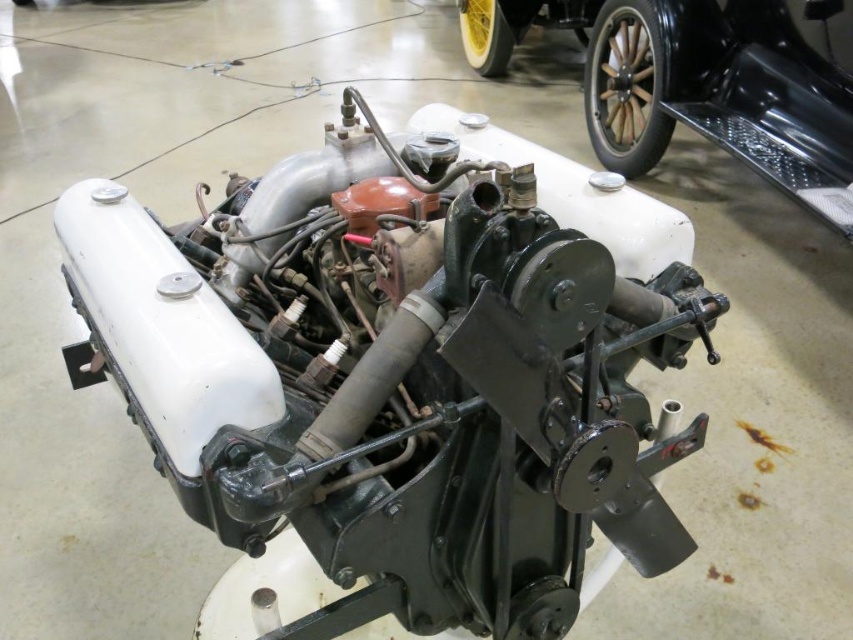
Is matte black engine at center positioned before metallic black engine at center?

Yes, it is.

Where is `matte black engine at center`? The image size is (853, 640). matte black engine at center is located at coordinates (403, 368).